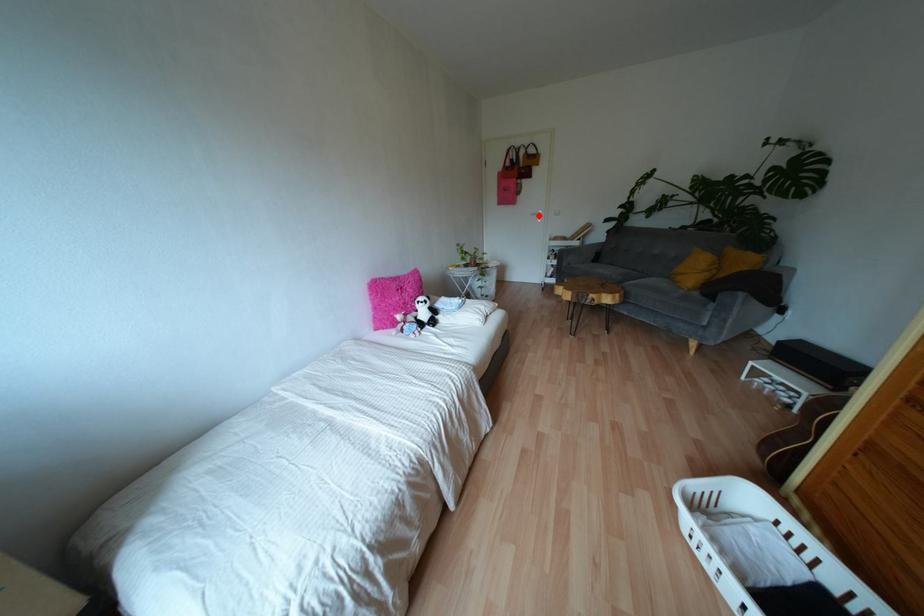
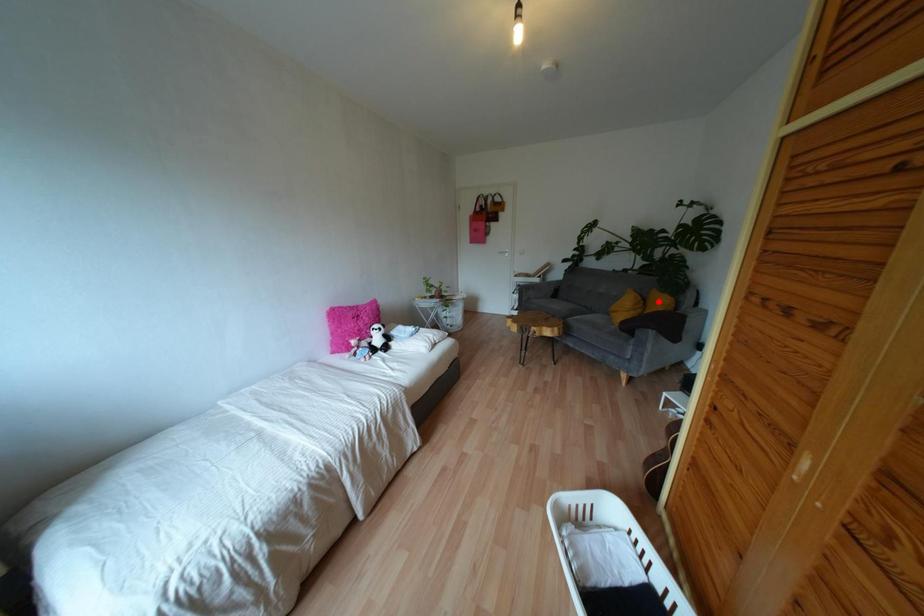
I am providing you with two images of the same scene from different viewpoints. A red point is marked on the first image and another point is marked on the second image. Does the point marked in image1 correspond to the same location as the one in image2?

No